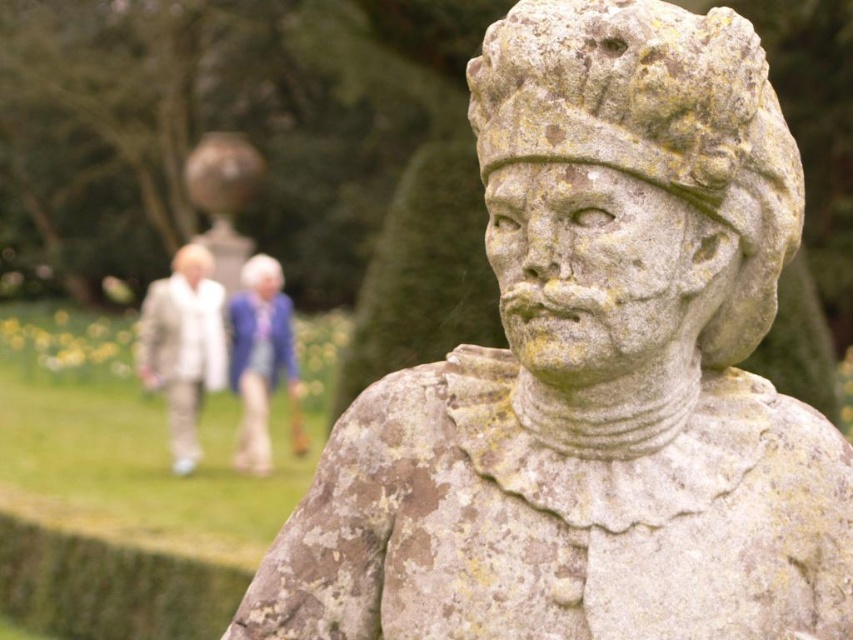
You are standing in front of the statue and want to place two markers at the locations of point (686, 58) and point (273, 346). Which marker will be placed closer to your current position?

Point (686, 58) is closer to the viewer than point (273, 346), so the marker at point (686, 58) will be closer to your current position.

You are an art conservator examining the statue. You notice the weathered stone statue at center and the matte white head at center. Which object is bigger in size?

The weathered stone statue at center is larger in size compared to the matte white head at center.

You are an art student analyzing the image of a historical statue. You notice two objects labeled as the weathered stone statue at center and the matte stone head at center. Which one do you think is larger in size?

The weathered stone statue at center is bigger than the matte stone head at center, so the weathered stone statue at center is larger in size.